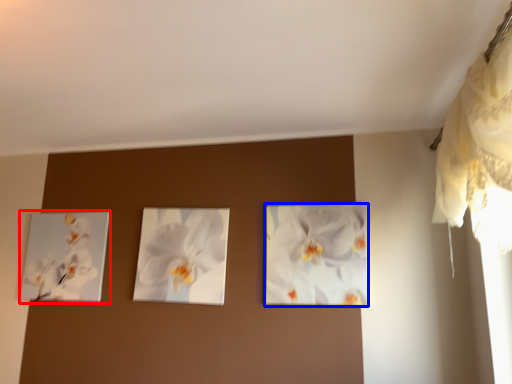
Question: Which object appears closest to the camera in this image, picture frame (highlighted by a red box) or flower (highlighted by a blue box)?

Choices:
 (A) picture frame
 (B) flower

Answer: (B)